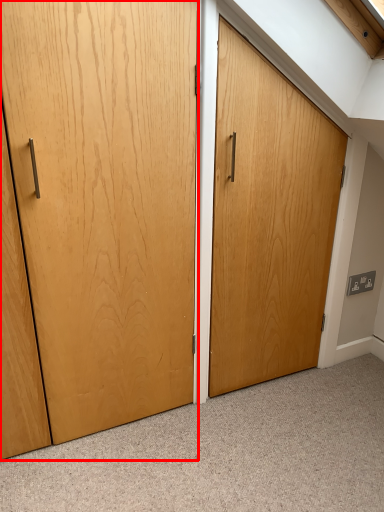
Question: Considering the relative positions of door (annotated by the red box) and electric outlet in the image provided, where is door (annotated by the red box) located with respect to the staircase?

Choices:
 (A) left
 (B) right

Answer: (A)